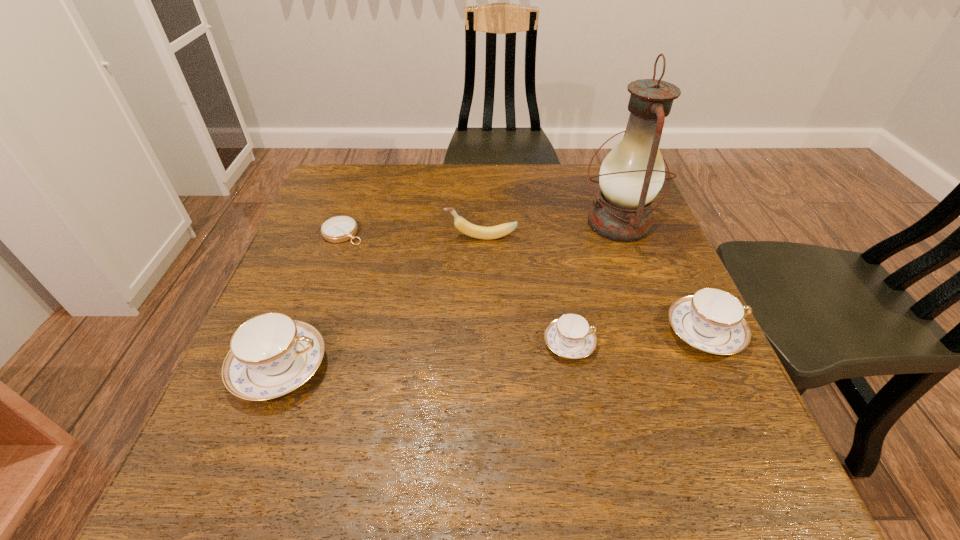
Find the location of a particular element. object at the near left corner is located at coordinates (270, 355).

Image resolution: width=960 pixels, height=540 pixels. In order to click on object positioned at the far right corner in this screenshot , I will do `click(631, 175)`.

Where is `free point at the far edge`? free point at the far edge is located at coordinates (518, 204).

Locate an element on the screen. free space at the near edge of the desktop is located at coordinates (500, 402).

Where is `vacant space at the left edge`? vacant space at the left edge is located at coordinates (309, 271).

The width and height of the screenshot is (960, 540). In the image, there is a desktop. Find the location of `vacant space at the right edge`. vacant space at the right edge is located at coordinates (661, 269).

The image size is (960, 540). Identify the location of free space that is in between the fourth object from right to left and the shortest object. (412, 235).

Locate an element on the screen. The height and width of the screenshot is (540, 960). vacant area that lies between the rightmost teacup and the tallest object is located at coordinates (661, 278).

The width and height of the screenshot is (960, 540). Identify the location of vacant space that is in between the third object from left to right and the oil lamp. coord(550,230).

Where is `free spot between the leftmost teacup and the second tallest teacup`? Image resolution: width=960 pixels, height=540 pixels. free spot between the leftmost teacup and the second tallest teacup is located at coordinates (492, 349).